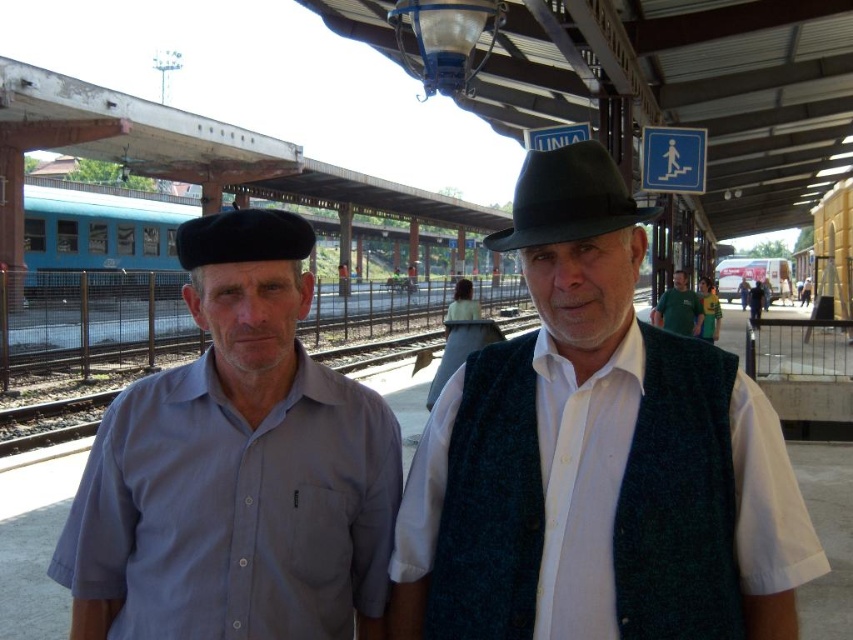
Can you confirm if light blue cotton shirt at left is positioned above black felt beret at left?

Actually, light blue cotton shirt at left is below black felt beret at left.

Which is in front, point (350, 476) or point (285, 216)?

Point (285, 216) is more forward.

This screenshot has width=853, height=640. Identify the location of light blue cotton shirt at left. tap(236, 468).

Is green knitted vest at center below green fabric shirt at center?

Yes.

Where is `green knitted vest at center`? The height and width of the screenshot is (640, 853). green knitted vest at center is located at coordinates pyautogui.click(x=596, y=458).

Is light blue cotton shirt at left smaller than green fabric shirt at center?

Yes.

Image resolution: width=853 pixels, height=640 pixels. Describe the element at coordinates (236, 468) in the screenshot. I see `light blue cotton shirt at left` at that location.

Locate an element on the screen. light blue cotton shirt at left is located at coordinates (236, 468).